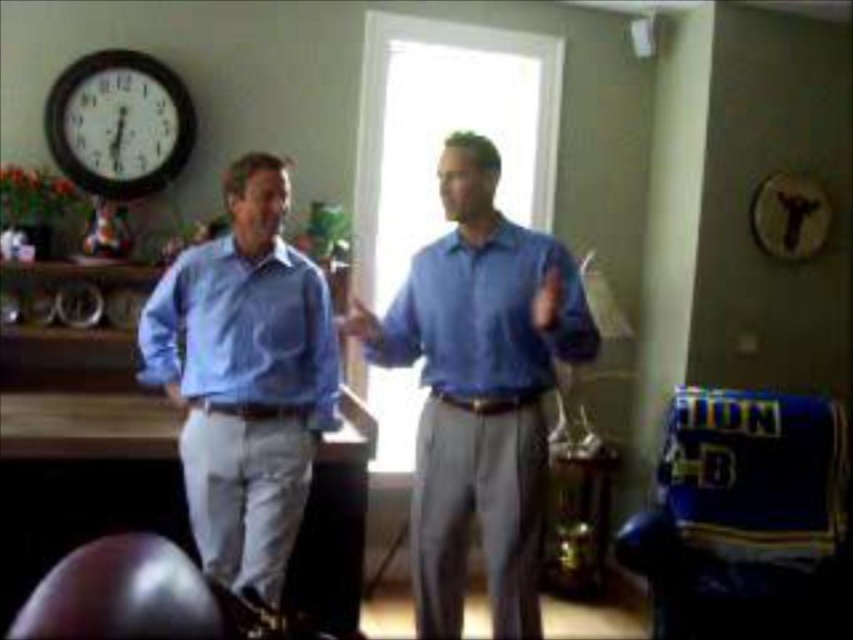
Does light blue cotton shirt at left have a larger size compared to matte blue shirt at left?

Yes.

Locate an element on the screen. light blue cotton shirt at left is located at coordinates (245, 380).

Which is in front, point (477, 468) or point (267, 552)?

Positioned in front is point (267, 552).

Does blue smooth shirt at center have a lesser height compared to light blue cotton shirt at left?

In fact, blue smooth shirt at center may be taller than light blue cotton shirt at left.

Who is more distant from viewer, [467,152] or [258,464]?

The point [258,464] is behind.

Locate an element on the screen. blue smooth shirt at center is located at coordinates (479, 390).

Is blue smooth shirt at center above matte blue shirt at center?

Actually, blue smooth shirt at center is below matte blue shirt at center.

Does blue smooth shirt at center have a lesser width compared to matte blue shirt at center?

No, blue smooth shirt at center is not thinner than matte blue shirt at center.

Where is `blue smooth shirt at center`? blue smooth shirt at center is located at coordinates (479, 390).